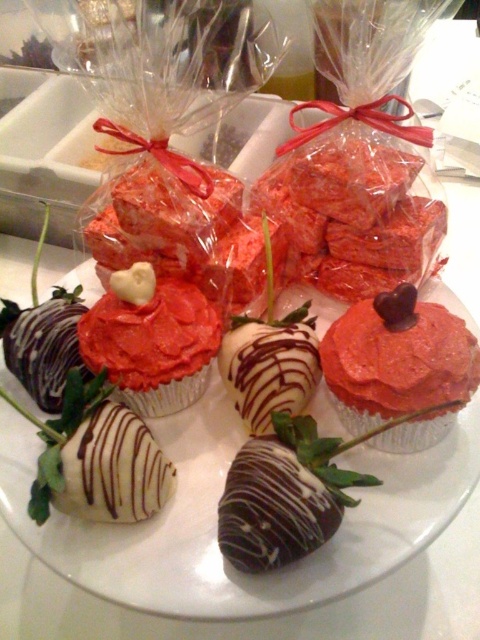
You are a dessert lover looking at the glass plate with desserts. You want to grab the closest dessert to you. Which one should you choose between the matte pink cupcake at center and the red velvet cake at center?

The matte pink cupcake at center is closer to the viewer than the red velvet cake at center, so you should choose the matte pink cupcake at center.

You are holding a dessert platter and want to place a new chocolate truffle at the point exactly 26.60 inches away from the viewer. Is the point at coordinates point (400, 337) suitable for placing the truffle?

Yes, the point at coordinates point (400, 337) is exactly 26.60 inches away from the viewer, so placing the chocolate truffle there would be suitable.